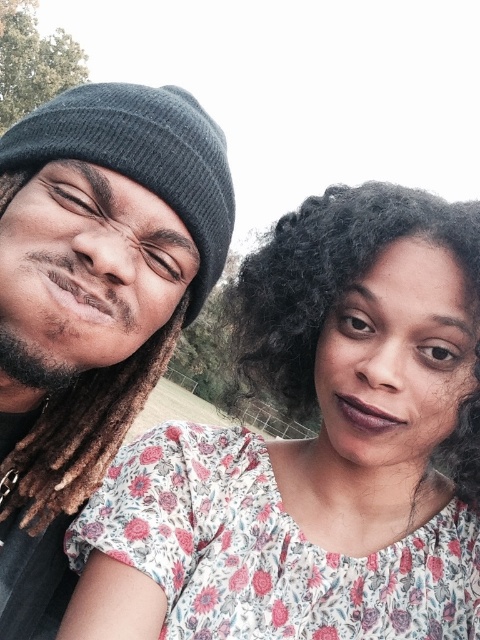
You are a photographer trying to decide which object to focus on first between the dark gray knit beanie at left and the curly dark brown hair at upper right. Based on their thickness, which one should you choose to ensure the focus is sharp?

The dark gray knit beanie at left is thinner than the curly dark brown hair at upper right, so focusing on the curly dark brown hair at upper right would be better as thicker objects are easier to focus on sharply.

You are a photographer trying to capture a candid shot of the two people in the park. You want to ensure that both subjects are in focus. If you focus on the point at (76, 422), will the point at (284, 310) also be in focus?

Point (76, 422) is behind point (284, 310). When focusing on the closer point, the depth of field may not extend to the farther point, so the point at (284, 310) might not be in focus.

You are a photographer trying to capture a closeup of the dark gray knit beanie at left and the brown dreadlocks at left. If your camera can only focus on objects wider than 10 cm, will both items be in focus?

The dark gray knit beanie at left has a larger width than the brown dreadlocks at left. Since the beanie is wider than 10 cm, it will be in focus. However, the dreadlocks might be narrower than 10 cm, so they may not be in focus.